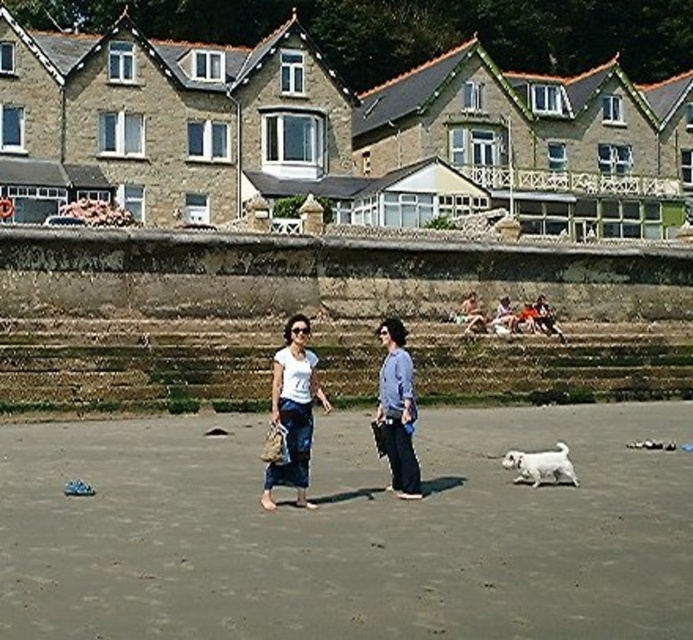
You are a photographer standing on the beach. You want to take a photo of the gray sand at center and the white fluffy dog at lower right. Which object is taller in the image?

The gray sand at center is taller than the white fluffy dog at lower right.

You are a photographer trying to capture a clear shot of both the white cotton shirt at center and the white fluffy dog at lower right. Since the background has bright sunlight, you want to adjust your camera settings to ensure both subjects are well lit. However, you notice that one of the subjects might be wider than the other. Which subject requires a wider aperture to capture its full width in the frame?

The white cotton shirt at center might be wider than the white fluffy dog at lower right, so the photographer should adjust the aperture to accommodate the wider subject, likely the white cotton shirt at center, to ensure it fits in the frame.

You are standing on the beach and want to place a rectangular box that is 1 meter wide. You see the gray sand at center and the blue denim jeans at center. Which area can accommodate the box without it overlapping the other object?

The gray sand at center can accommodate the box since its width is greater than the blue denim jeans at center, making it suitable for placing the 1 meter wide box without overlapping.